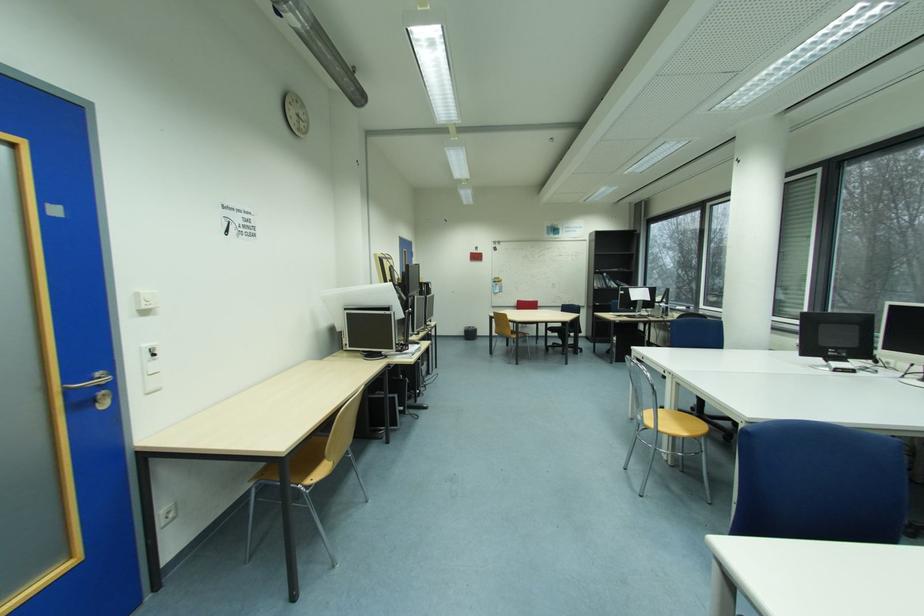
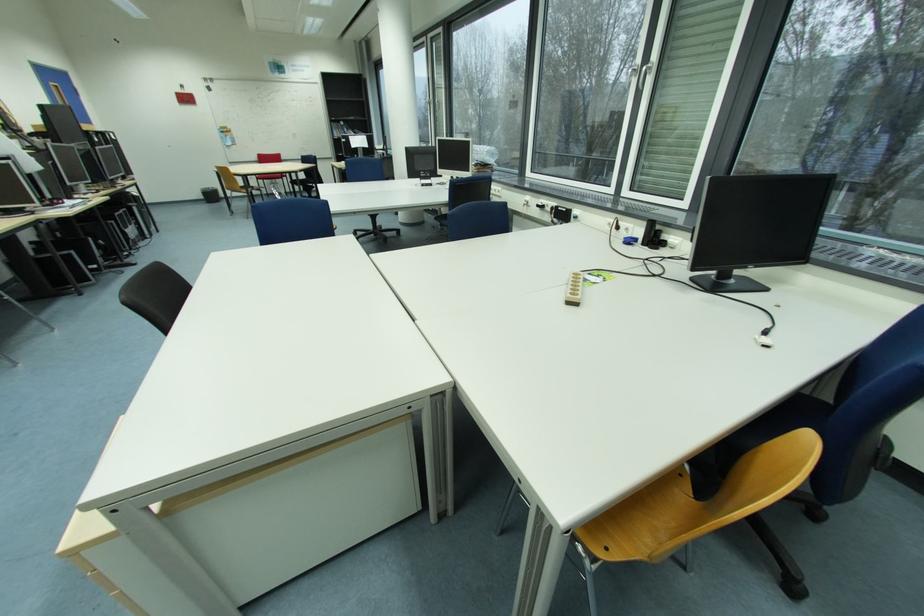
The point at (469, 334) is marked in the first image. Where is the corresponding point in the second image?

(209, 198)